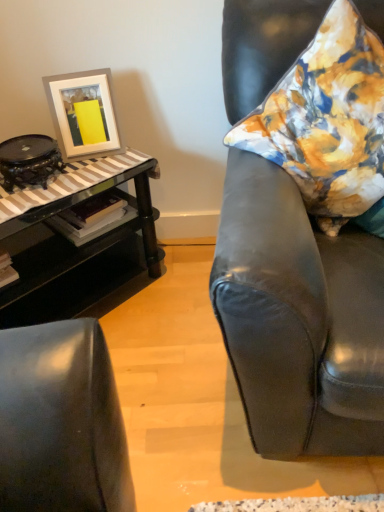
Question: Is matte black armchair at right positioned behind floral fabric pillow at right?

Choices:
 (A) yes
 (B) no

Answer: (B)

Question: Is there a large distance between matte black armchair at right and floral fabric pillow at right?

Choices:
 (A) yes
 (B) no

Answer: (B)

Question: Can you confirm if matte black armchair at right is wider than floral fabric pillow at right?

Choices:
 (A) no
 (B) yes

Answer: (B)

Question: Is matte black armchair at right thinner than floral fabric pillow at right?

Choices:
 (A) no
 (B) yes

Answer: (A)

Question: From the image's perspective, is matte black armchair at right located beneath floral fabric pillow at right?

Choices:
 (A) no
 (B) yes

Answer: (B)

Question: Is matte black armchair at right next to floral fabric pillow at right and touching it?

Choices:
 (A) no
 (B) yes

Answer: (A)

Question: Is black glass table at left located within matte black armchair at right?

Choices:
 (A) yes
 (B) no

Answer: (B)

Question: Can you confirm if matte black armchair at right is thinner than black glass table at left?

Choices:
 (A) no
 (B) yes

Answer: (A)

Question: From the image's perspective, is matte black armchair at right below black glass table at left?

Choices:
 (A) no
 (B) yes

Answer: (A)

Question: Is matte black armchair at right shorter than black glass table at left?

Choices:
 (A) no
 (B) yes

Answer: (A)

Question: From the image's perspective, is matte black armchair at right above black glass table at left?

Choices:
 (A) no
 (B) yes

Answer: (B)

Question: Can you confirm if matte black armchair at right is taller than black glass table at left?

Choices:
 (A) no
 (B) yes

Answer: (B)

Question: From a real-world perspective, is white matte picture frame at upper left positioned under matte black armchair at right based on gravity?

Choices:
 (A) no
 (B) yes

Answer: (A)